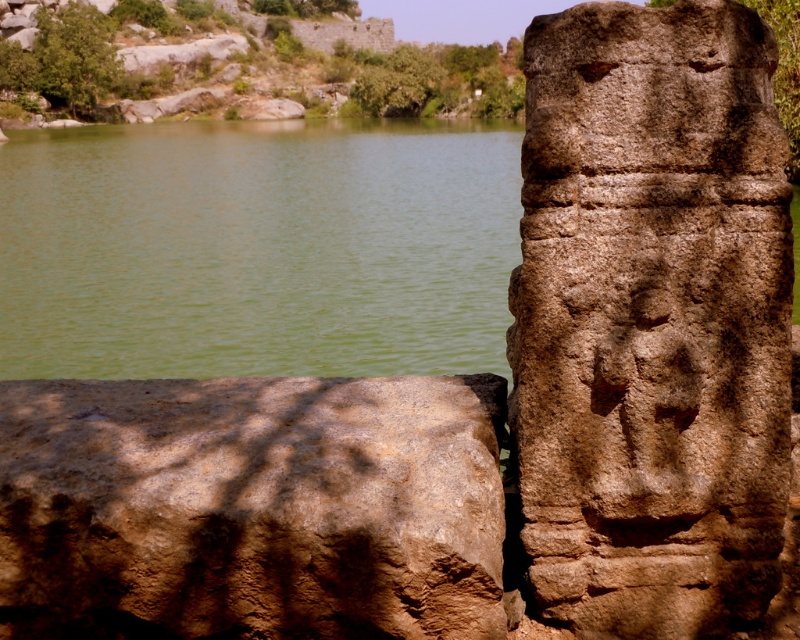
Is brown rough stone carving at right bigger than green water at center?

Actually, brown rough stone carving at right might be smaller than green water at center.

Which is behind, point (609, 544) or point (44, 324)?

Point (44, 324)

This screenshot has width=800, height=640. Describe the element at coordinates (652, 320) in the screenshot. I see `brown rough stone carving at right` at that location.

Where is `brown rough stone carving at right`? The height and width of the screenshot is (640, 800). brown rough stone carving at right is located at coordinates (652, 320).

Is brown rough stone at lower left above green water at center?

No, brown rough stone at lower left is not above green water at center.

Describe the element at coordinates (252, 508) in the screenshot. The image size is (800, 640). I see `brown rough stone at lower left` at that location.

Locate an element on the screen. This screenshot has height=640, width=800. brown rough stone at lower left is located at coordinates pos(252,508).

Image resolution: width=800 pixels, height=640 pixels. What do you see at coordinates (652, 320) in the screenshot?
I see `brown rough stone carving at right` at bounding box center [652, 320].

Who is positioned more to the left, brown rough stone carving at right or brown rough stone at lower left?

brown rough stone at lower left

Image resolution: width=800 pixels, height=640 pixels. What are the coordinates of `brown rough stone carving at right` in the screenshot? It's located at (652, 320).

Locate an element on the screen. brown rough stone carving at right is located at coordinates (652, 320).